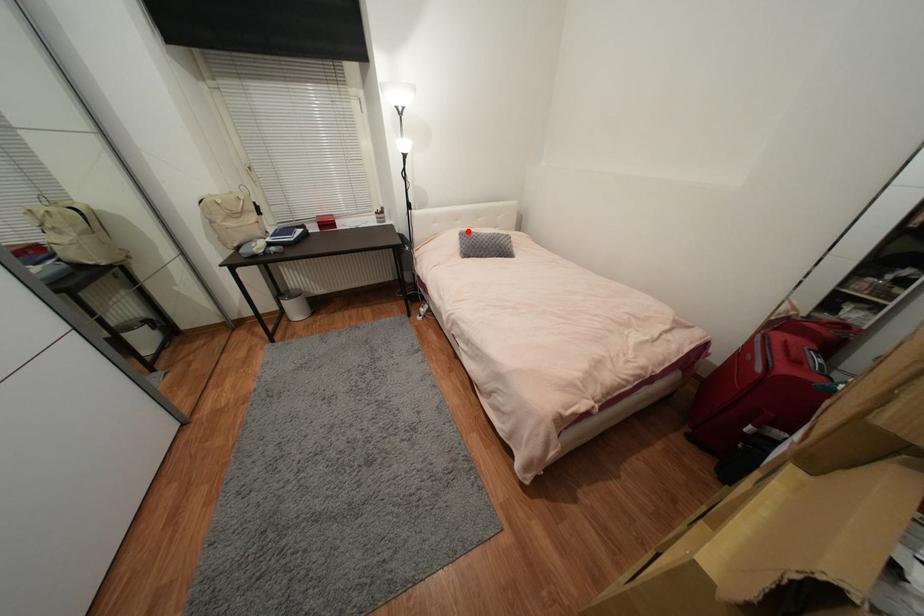
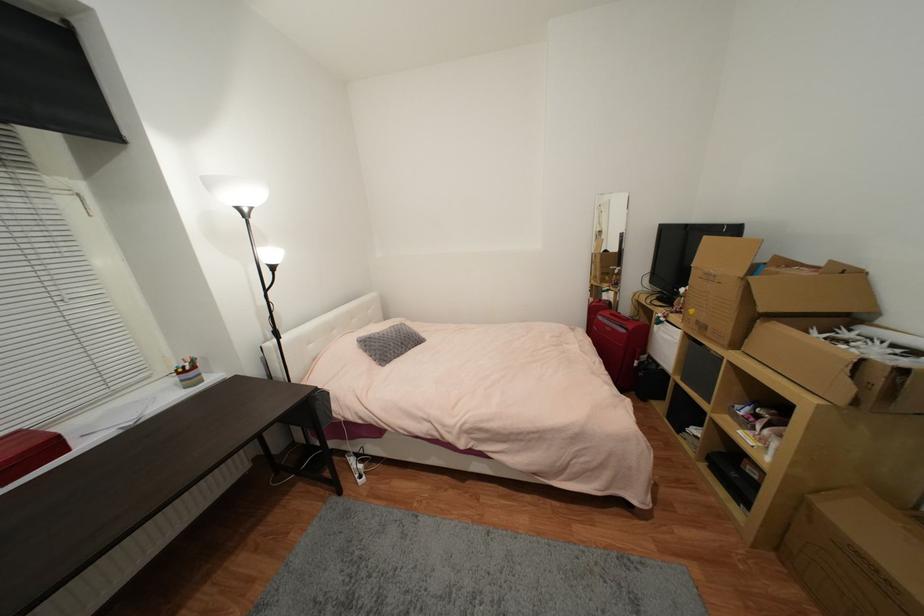
Question: I am providing you with two images of the same scene from different viewpoints. Given a red point in image1, look at the same physical point in image2. Is it:

Choices:
 (A) Closer to the viewpoint
 (B) Farther from the viewpoint

Answer: (B)